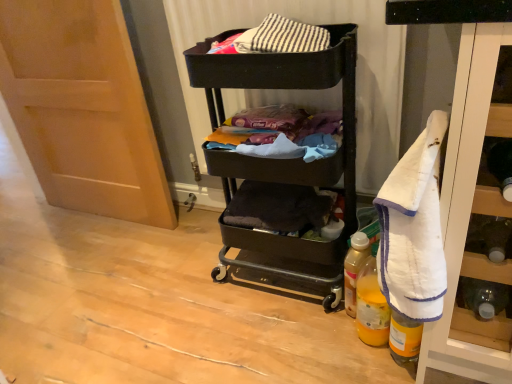
Where is `vacant space in front of translucent plastic bottle at lower right, positioned as the 3th bottle in front-to-back order`? The image size is (512, 384). vacant space in front of translucent plastic bottle at lower right, positioned as the 3th bottle in front-to-back order is located at coordinates (349, 354).